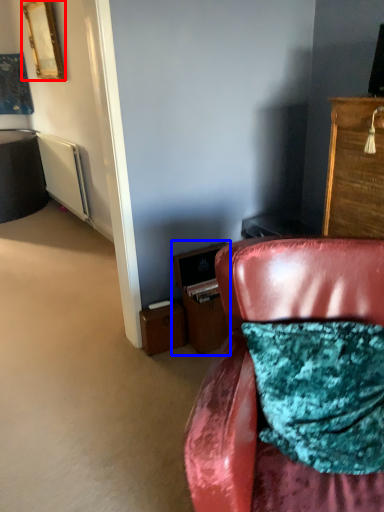
Question: Which object appears farthest to the camera in this image, picture frame (highlighted by a red box) or file cabinet (highlighted by a blue box)?

Choices:
 (A) picture frame
 (B) file cabinet

Answer: (A)